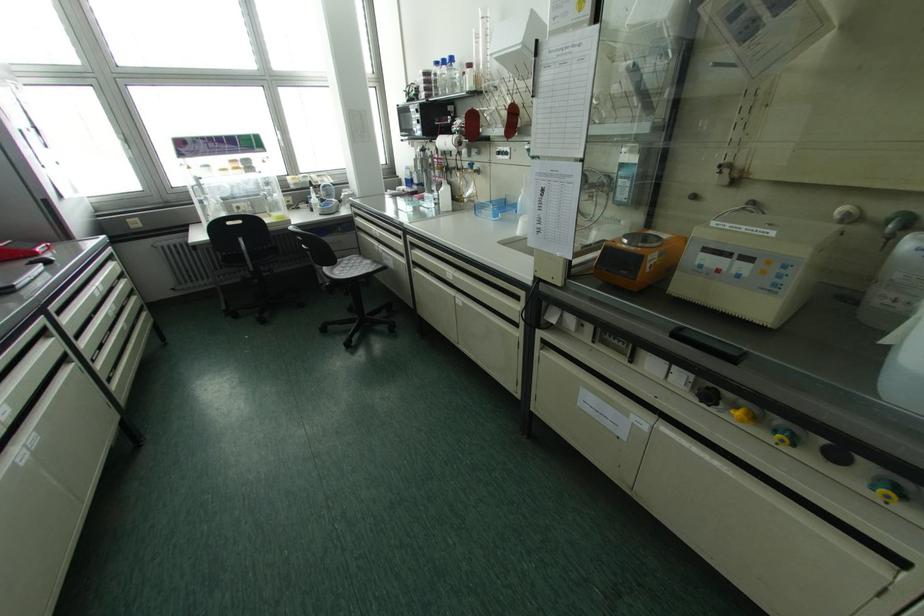
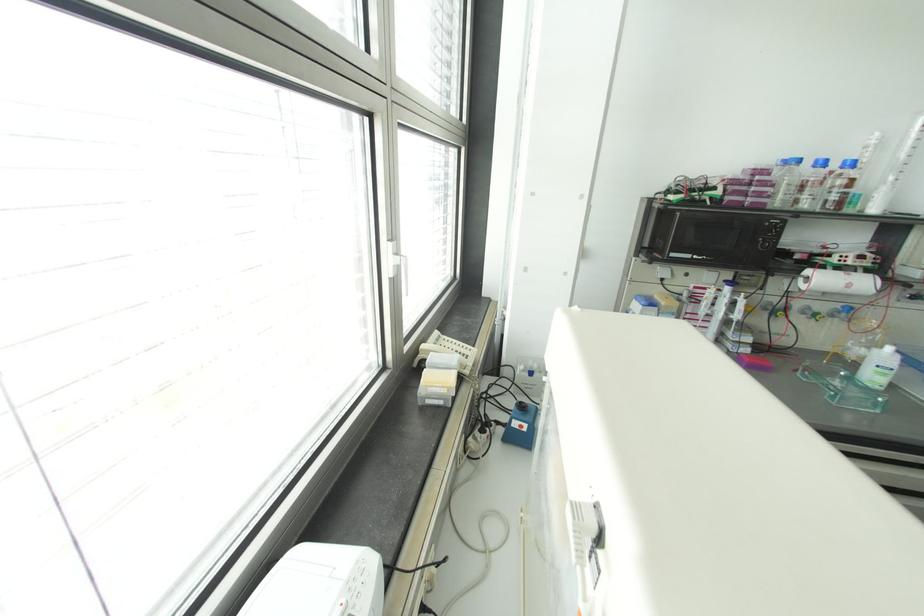
In the second image, find the point that corresponds to the point at 451,59 in the first image.

(852, 163)